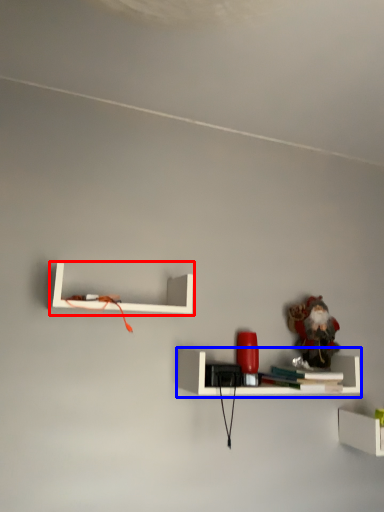
Question: Which point is closer to the camera, shelf (highlighted by a red box) or shelf (highlighted by a blue box)?

Choices:
 (A) shelf
 (B) shelf

Answer: (A)